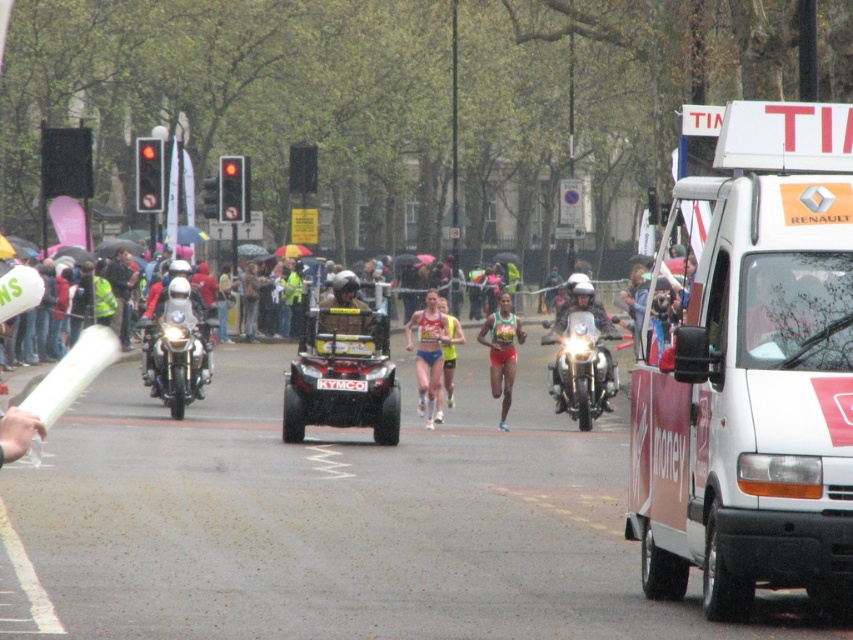
What is located at the point with coordinates (341, 374) in the image?

At point (341, 374) lies metallic silver quad bike at center.

You are a photographer at the marathon event. You want to capture a photo that includes both the matte blue shorts at center and the red running shorts at center. Which pair of shorts should you focus on first to ensure both are in the frame?

You should focus on the matte blue shorts at center first because it is larger in size than the red running shorts at center, ensuring it fits within the frame while the smaller red running shorts at center will also be captured.

You are a drone operator trying to capture aerial footage of the marathon route. Your drone is currently at position coordinates of 0.5, 0.9. The white matte van at upper right is blocking your view. Can you move your drone to the left to avoid the van?

The white matte van at upper right is at point (x=751, y=371). Since your drone is at (x=767, y=320), which is to the left and slightly above the van, moving left would take you further away from the van. However, since the van is at 0.581 on the x axis, moving left to a lower x coordinate would place the drone to the left of the van, potentially avoiding it. The exact feasibility depends on the drone path and space available, but based on coordinates, moving left could help avoid the obstruction.